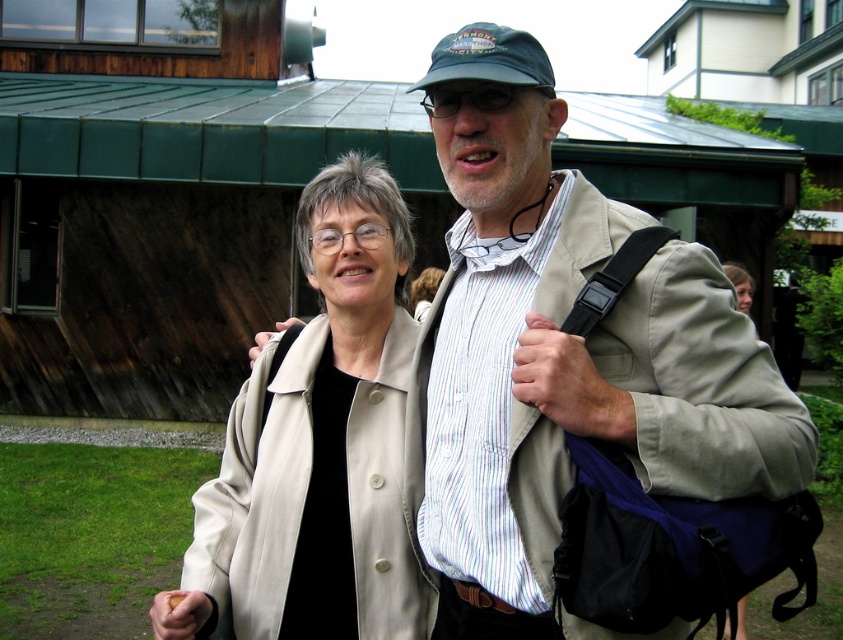
Is beige fabric coat at center to the right of beige fabric trench coat at center from the viewer's perspective?

In fact, beige fabric coat at center is to the left of beige fabric trench coat at center.

Is point (240, 525) farther from camera compared to point (721, 410)?

Yes, it is behind point (721, 410).

This screenshot has height=640, width=843. I want to click on beige fabric coat at center, so click(317, 445).

Which is more to the left, beige fabric coat at center or dark blue fabric baseball cap at upper center?

From the viewer's perspective, beige fabric coat at center appears more on the left side.

Can you confirm if beige fabric coat at center is bigger than dark blue fabric baseball cap at upper center?

Actually, beige fabric coat at center might be smaller than dark blue fabric baseball cap at upper center.

Locate an element on the screen. beige fabric coat at center is located at coordinates (317, 445).

Does beige fabric trench coat at center have a greater height compared to dark blue fabric baseball cap at upper center?

In fact, beige fabric trench coat at center may be shorter than dark blue fabric baseball cap at upper center.

Can you confirm if beige fabric trench coat at center is smaller than dark blue fabric baseball cap at upper center?

Indeed, beige fabric trench coat at center has a smaller size compared to dark blue fabric baseball cap at upper center.

You are a GUI agent. You are given a task and a screenshot of the screen. Output one action in this format:
    pyautogui.click(x=<x>, y=<y>)
    Task: Click on the beige fabric trench coat at center
    The image size is (843, 640).
    Given the screenshot: What is the action you would take?
    pyautogui.click(x=701, y=385)